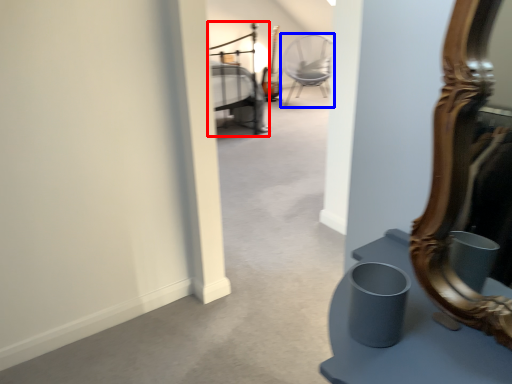
Question: Which point is closer to the camera, bed (highlighted by a red box) or chair (highlighted by a blue box)?

Choices:
 (A) bed
 (B) chair

Answer: (A)